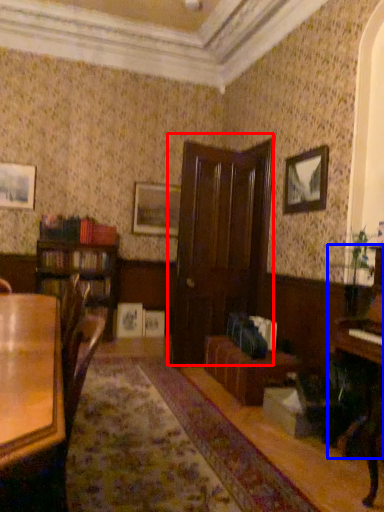
Question: Among these objects, which one is nearest to the camera, door (highlighted by a red box) or piano (highlighted by a blue box)?

Choices:
 (A) door
 (B) piano

Answer: (B)